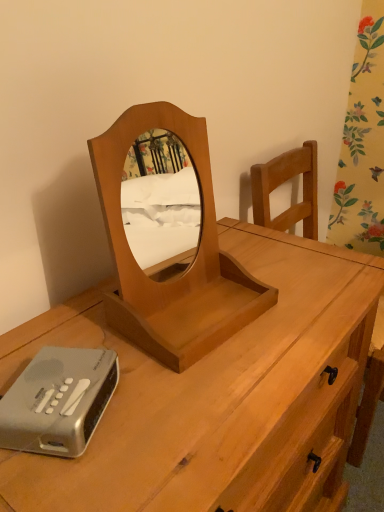
Find the location of a particular element. Image resolution: width=384 pixels, height=512 pixels. free space to the back side of silver plastic alarm clock at lower left is located at coordinates (76, 331).